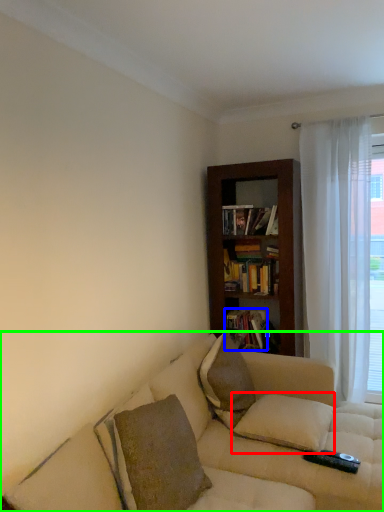
Question: Which object is positioned farthest from pillow (highlighted by a red box)? Select from book (highlighted by a blue box) and studio couch (highlighted by a green box).

Choices:
 (A) book
 (B) studio couch

Answer: (A)